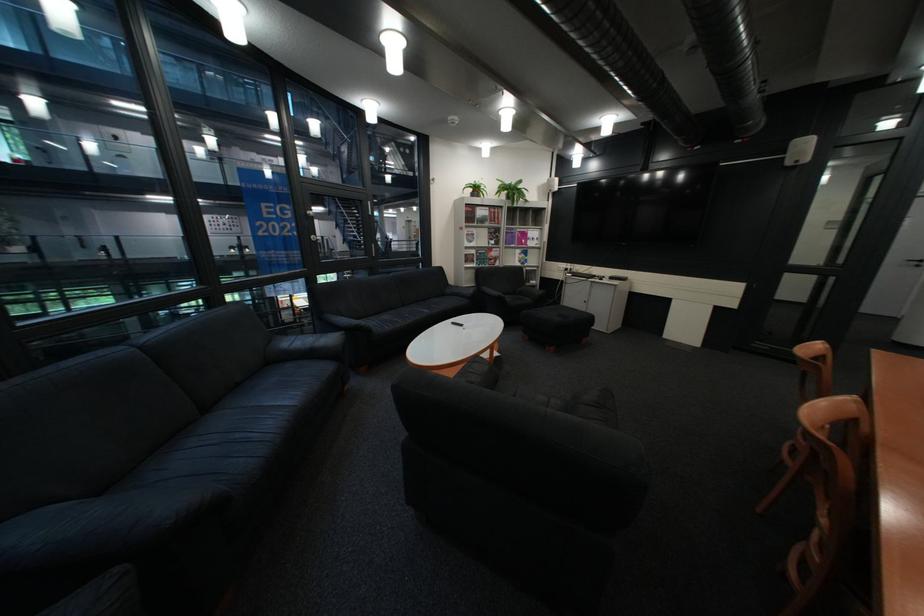
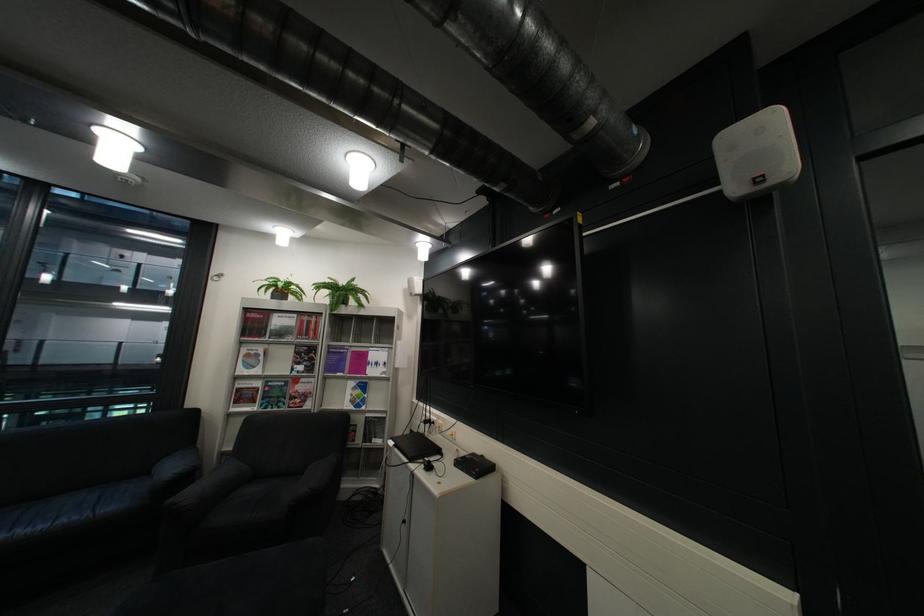
The point at (505, 233) is marked in the first image. Where is the corresponding point in the second image?

(311, 353)